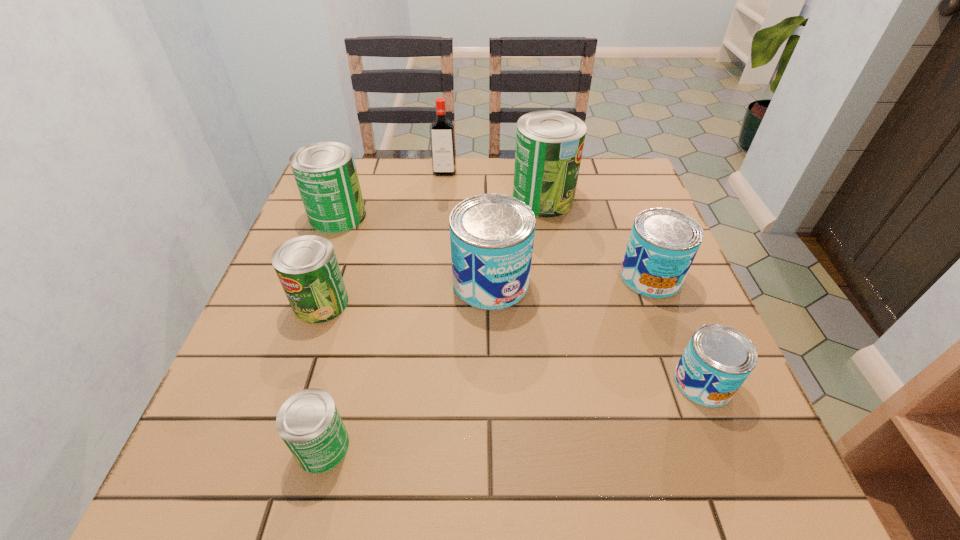
The image size is (960, 540). Identify the location of the nearest green can. (309, 423).

Locate an element on the screen. the nearest object is located at coordinates (309, 423).

The height and width of the screenshot is (540, 960). I want to click on vacant space positioned on the front and back of the farthest object, so click(443, 193).

The height and width of the screenshot is (540, 960). What are the coordinates of `blank space located 0.230m on the front of the rightmost green can` in the screenshot? It's located at (557, 280).

Find the location of a particular element. The width and height of the screenshot is (960, 540). free location located on the right of the third smallest green can is located at coordinates (445, 217).

This screenshot has width=960, height=540. Find the location of `free space located on the back of the leftmost blue can`. free space located on the back of the leftmost blue can is located at coordinates (489, 207).

The width and height of the screenshot is (960, 540). What are the coordinates of `vacant space located 0.240m on the left of the second smallest blue can` in the screenshot? It's located at (515, 277).

Identify the location of vacant space located 0.260m on the back of the second smallest green can. The width and height of the screenshot is (960, 540). (351, 214).

This screenshot has width=960, height=540. What are the coordinates of `free location located on the left of the sixth farthest can` in the screenshot? It's located at (456, 383).

Where is `vacant space located 0.110m on the left of the nearest object`? Image resolution: width=960 pixels, height=540 pixels. vacant space located 0.110m on the left of the nearest object is located at coordinates (230, 447).